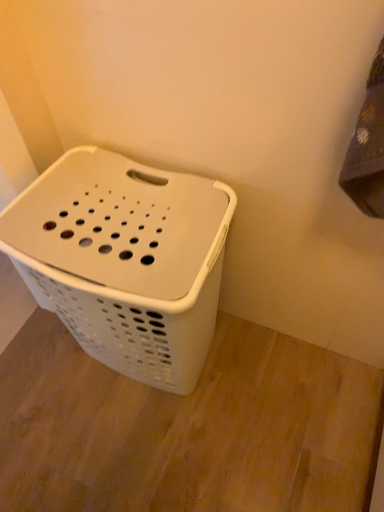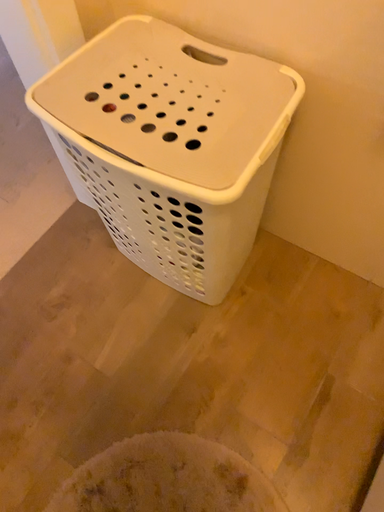
Question: Which way did the camera rotate in the video?

Choices:
 (A) rotated downward
 (B) rotated upward

Answer: (A)